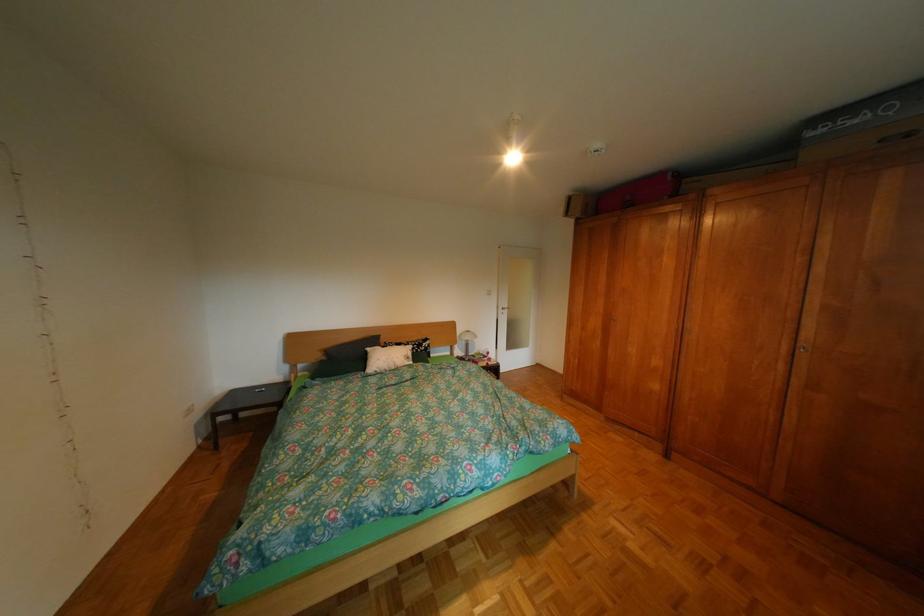
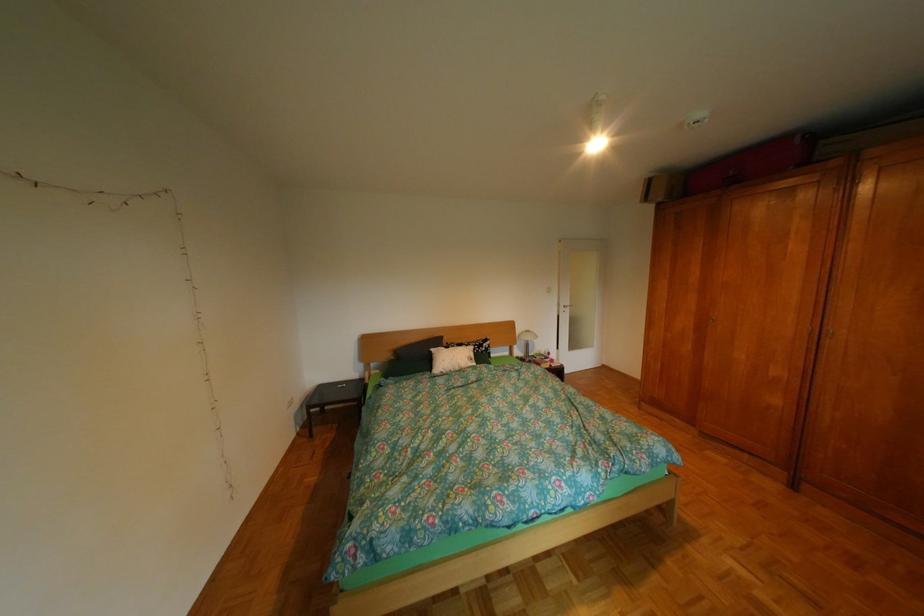
Question: The camera is either moving clockwise (left) or counter-clockwise (right) around the object. The first image is from the beginning of the video and the second image is from the end. Is the camera moving left or right when shooting the video?

Choices:
 (A) Left
 (B) Right

Answer: (B)